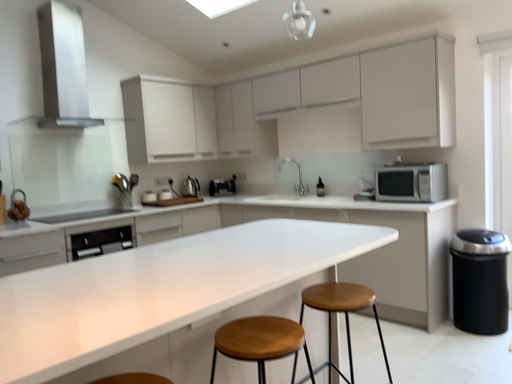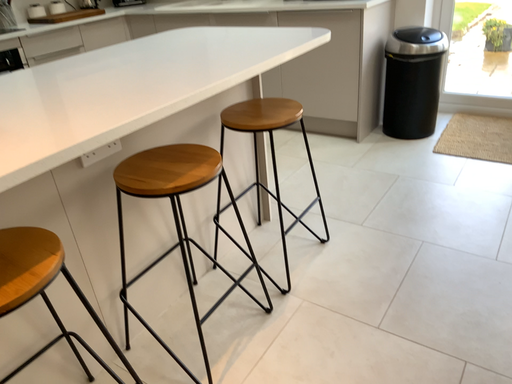
Question: How did the camera likely rotate when shooting the video?

Choices:
 (A) rotated right
 (B) rotated left

Answer: (A)